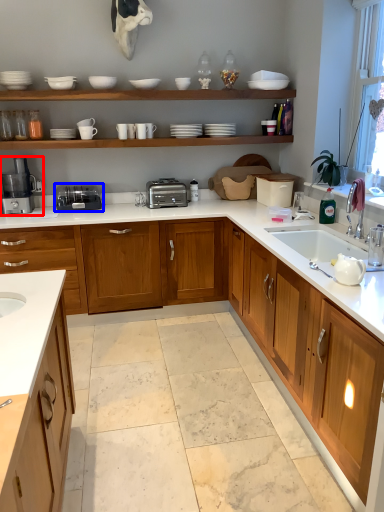
Question: Which object appears closest to the camera in this image, coffee machine (highlighted by a red box) or appliance (highlighted by a blue box)?

Choices:
 (A) coffee machine
 (B) appliance

Answer: (A)